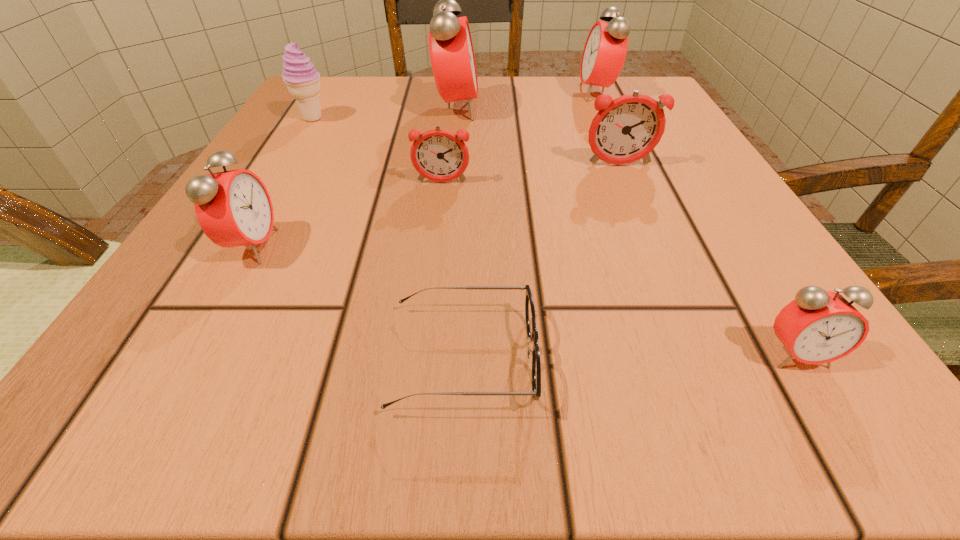
Identify the location of the smaller reddish-pink alarm clock. (439, 155).

Where is `the rightmost red alarm clock`? the rightmost red alarm clock is located at coordinates (819, 326).

Locate an element on the screen. The image size is (960, 540). the rightmost object is located at coordinates (819, 326).

Identify the location of black spectacles. (532, 332).

At what (x,y) coordinates should I click in order to perform the action: click on spectacles. Please return your answer as a coordinate pair (x, y). Looking at the image, I should click on (532, 332).

Find the location of a particular element. This screenshot has width=960, height=540. free space located on the front-facing side of the tallest object is located at coordinates (556, 109).

Locate an element on the screen. vacant space located on the front-facing side of the second red alarm clock from right to left is located at coordinates (478, 93).

At what (x,y) coordinates should I click in order to perform the action: click on free space located 0.330m on the front-facing side of the second red alarm clock from right to left. Please return your answer as a coordinate pair (x, y). Looking at the image, I should click on (420, 93).

Locate an element on the screen. free spot located 0.070m on the front-facing side of the second red alarm clock from right to left is located at coordinates (545, 93).

What are the coordinates of `vacant space located 0.110m on the back of the icecream` in the screenshot? It's located at (330, 88).